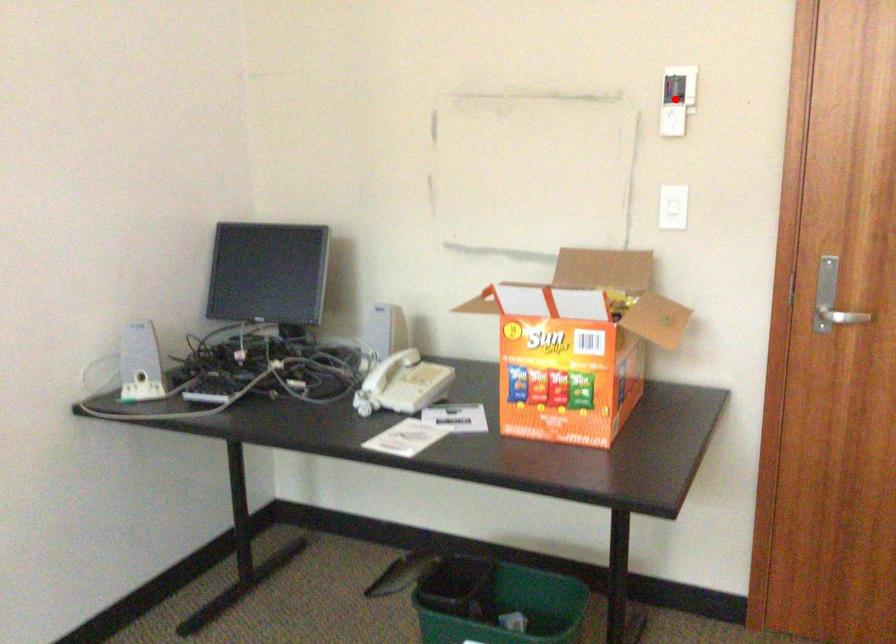
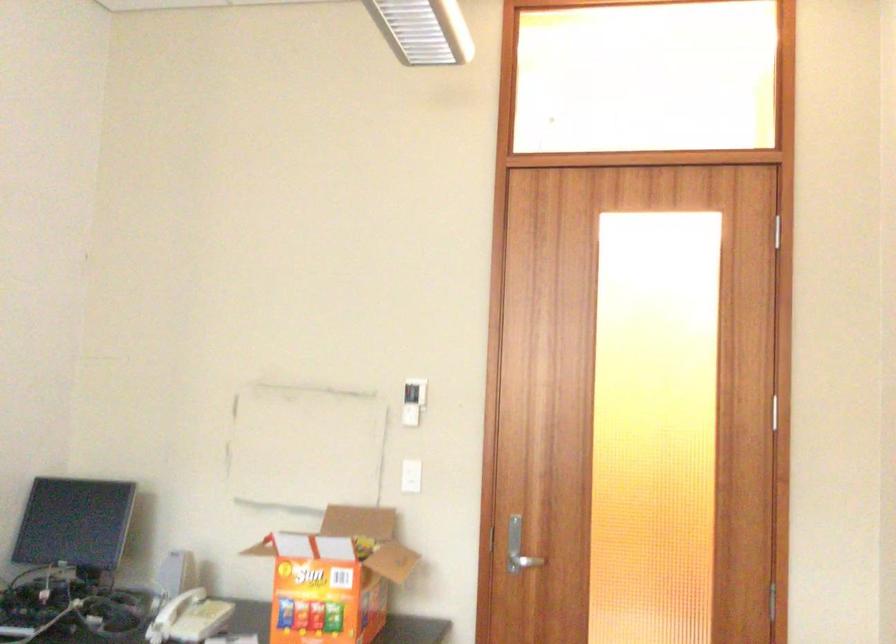
Question: I am providing you with two images of the same scene from different viewpoints. Image1 has a red point marked. In image2, the corresponding 3D location appears at what relative position? Reply with the corresponding letter.

Choices:
 (A) Closer
 (B) Farther

Answer: (B)